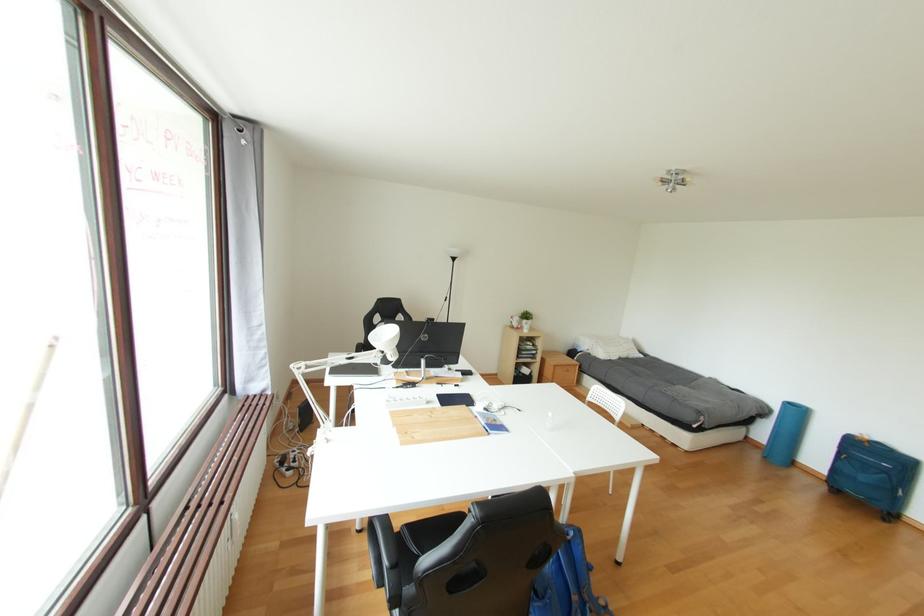
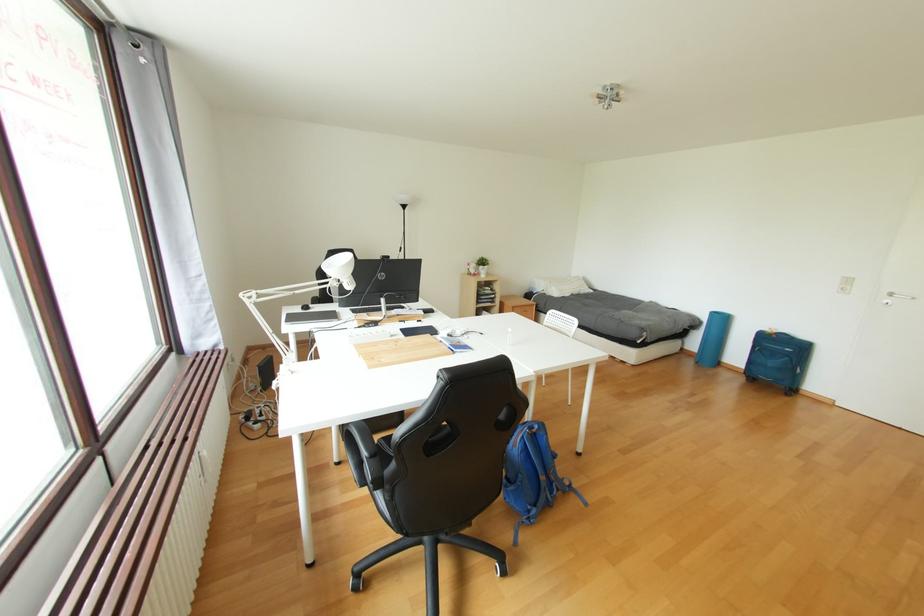
Question: The images are taken continuously from a first-person perspective. In which direction is your viewpoint rotating?

Choices:
 (A) Left
 (B) Right
 (C) Up
 (D) Down

Answer: (B)